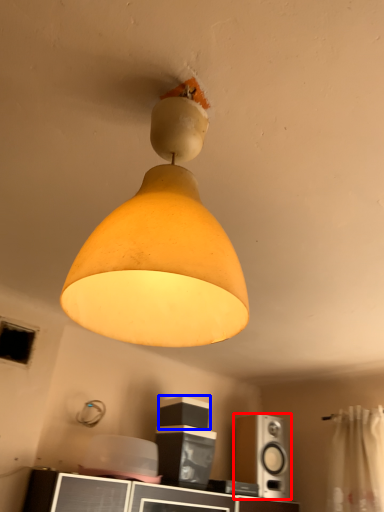
Question: Which of the following is the farthest to the observer, speaker (highlighted by a red box) or speaker (highlighted by a blue box)?

Choices:
 (A) speaker
 (B) speaker

Answer: (A)